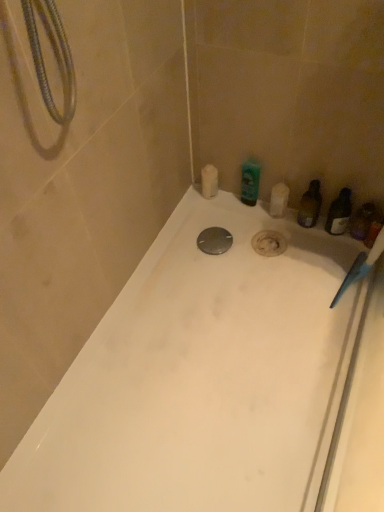
Find the location of a particular element. The width and height of the screenshot is (384, 512). free region on the left part of translucent plastic bottle at right, arranged as the third toiletry when viewed from the left is located at coordinates (255, 232).